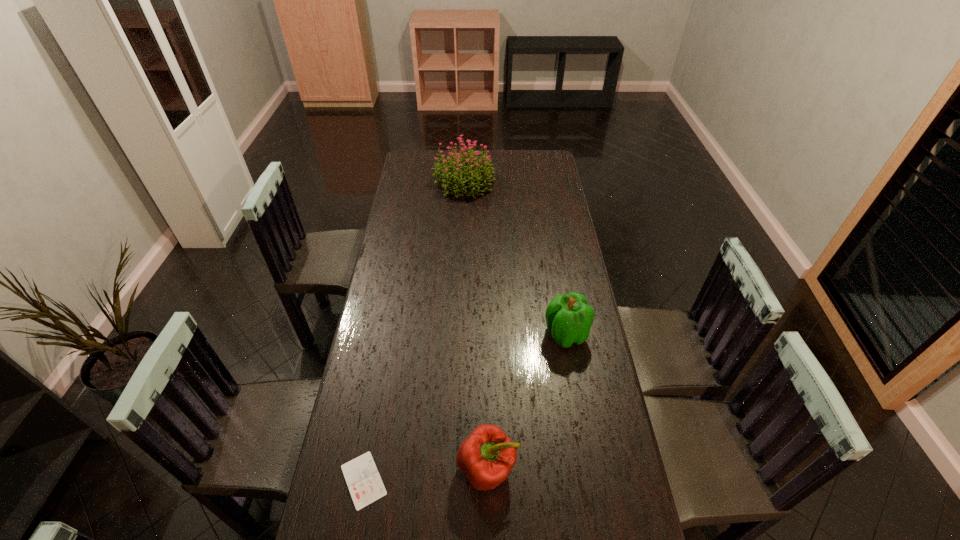
Where is `the farthest object`? The width and height of the screenshot is (960, 540). the farthest object is located at coordinates (453, 171).

You are a GUI agent. You are given a task and a screenshot of the screen. Output one action in this format:
    pyautogui.click(x=<x>, y=<y>)
    Task: Click on the bouquet
    
    Given the screenshot: What is the action you would take?
    pyautogui.click(x=453, y=171)

The height and width of the screenshot is (540, 960). I want to click on the farther bell pepper, so click(569, 318).

This screenshot has height=540, width=960. I want to click on the rightmost object, so click(x=569, y=318).

Find the location of a particular element. Image resolution: width=960 pixels, height=540 pixels. the nearer bell pepper is located at coordinates pos(486,457).

This screenshot has height=540, width=960. In order to click on the left bell pepper in this screenshot , I will do `click(486, 457)`.

Find the location of a particular element. the leftmost object is located at coordinates (365, 485).

Locate an element on the screen. The height and width of the screenshot is (540, 960). the shortest object is located at coordinates (365, 485).

Where is `free space located 0.150m on the back of the farthest object`? free space located 0.150m on the back of the farthest object is located at coordinates (466, 151).

Identify the location of vacant region located on the left of the farther bell pepper. (449, 334).